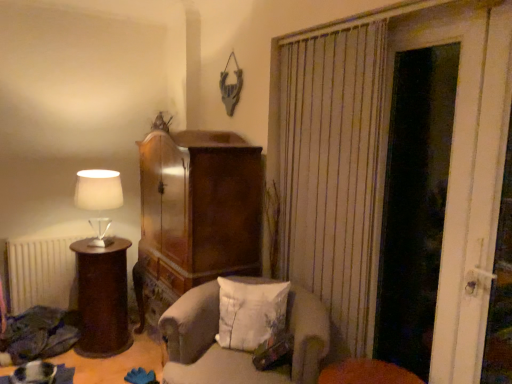
What do you see at coordinates (41, 273) in the screenshot?
I see `white matte radiator at lower left` at bounding box center [41, 273].

Locate an element on the screen. The height and width of the screenshot is (384, 512). light gray fabric chair at center is located at coordinates (237, 350).

Locate an element on the screen. Image resolution: width=512 pixels, height=384 pixels. white wooden door at right is located at coordinates click(428, 184).

The height and width of the screenshot is (384, 512). What do you see at coordinates (250, 313) in the screenshot?
I see `white soft cushion at center` at bounding box center [250, 313].

What is the approximate width of wooden side table at left?

It is 16.15 inches.

Describe the element at coordinates (102, 298) in the screenshot. I see `wooden side table at left` at that location.

Describe the element at coordinates (98, 190) in the screenshot. I see `matte white lampshade at left` at that location.

The width and height of the screenshot is (512, 384). I want to click on white matte radiator at lower left, so click(41, 273).

Which object is wider, white wooden door at right or matte white lampshade at left?

With larger width is matte white lampshade at left.

Is white wooden door at right oriented towards matte white lampshade at left?

No, white wooden door at right is not oriented towards matte white lampshade at left.

Considering the relative sizes of white wooden door at right and matte white lampshade at left in the image provided, is white wooden door at right smaller than matte white lampshade at left?

No, white wooden door at right is not smaller than matte white lampshade at left.

Looking at this image, what's the angular difference between white wooden door at right and matte white lampshade at left's facing directions?

88.3 degrees separate the facing orientations of white wooden door at right and matte white lampshade at left.

Image resolution: width=512 pixels, height=384 pixels. Find the location of `radiator below the white wooden door at right (from the image's perspective)`. radiator below the white wooden door at right (from the image's perspective) is located at coordinates (41, 273).

Which object is positioned more to the right, white matte radiator at lower left or white wooden door at right?

Positioned to the right is white wooden door at right.

From a real-world perspective, who is located higher, white matte radiator at lower left or white wooden door at right?

white wooden door at right is physically above.

Would you say white matte radiator at lower left contains white wooden door at right?

That's incorrect, white wooden door at right is not inside white matte radiator at lower left.

In the scene shown: Is matte white lampshade at left at the back of white soft cushion at center?

No, white soft cushion at center is not facing away from matte white lampshade at left.

Would you say white soft cushion at center is outside matte white lampshade at left?

Yes, white soft cushion at center is outside of matte white lampshade at left.

Considering the relative sizes of white soft cushion at center and matte white lampshade at left in the image provided, is white soft cushion at center shorter than matte white lampshade at left?

Yes.

Consider the image. Which object is closer to the camera taking this photo, white matte radiator at lower left or wooden side table at left?

wooden side table at left is closer to the camera.

Based on the photo, is white matte radiator at lower left turned away from wooden side table at left?

That's right, white matte radiator at lower left is facing away from wooden side table at left.

Is white matte radiator at lower left directly adjacent to wooden side table at left?

white matte radiator at lower left is not next to wooden side table at left, and they're not touching.

Which object is positioned more to the left, white matte radiator at lower left or wooden side table at left?

white matte radiator at lower left is more to the left.

Between white wooden door at right and white matte radiator at lower left, which one is positioned behind?

white matte radiator at lower left is more distant.

The width and height of the screenshot is (512, 384). I want to click on radiator on the left of white wooden door at right, so click(41, 273).

Consider the image. From the image's perspective, which object appears higher, white wooden door at right or white matte radiator at lower left?

white wooden door at right, from the image's perspective.

How far apart are white wooden door at right and white matte radiator at lower left?

They are 7.88 feet apart.

Is the position of light gray fabric chair at center less distant than that of white soft cushion at center?

Yes.

Is light gray fabric chair at center wider or thinner than white soft cushion at center?

light gray fabric chair at center is wider than white soft cushion at center.

From a real-world perspective, which object rests below the other?

In real-world perspective, light gray fabric chair at center is lower.

Considering the points (325, 335) and (251, 307), which point is in front, point (325, 335) or point (251, 307)?

Point (325, 335)

Considering the sizes of objects white matte radiator at lower left and white soft cushion at center in the image provided, who is bigger, white matte radiator at lower left or white soft cushion at center?

Bigger between the two is white matte radiator at lower left.

Is white matte radiator at lower left completely or partially outside of white soft cushion at center?

Yes.

Which point is more distant from viewer, (22, 304) or (279, 311)?

The point (22, 304) is farther from the camera.

Considering the relative positions of white matte radiator at lower left and white soft cushion at center in the image provided, is white matte radiator at lower left in front of white soft cushion at center?

No, white matte radiator at lower left is further to the viewer.

In order to click on door above the matte white lampshade at left (from a real-world perspective) in this screenshot , I will do click(x=428, y=184).

Where is `radiator that appears behind the white wooden door at right`? radiator that appears behind the white wooden door at right is located at coordinates (41, 273).

Considering their positions, is matte white lampshade at left positioned further to white matte radiator at lower left than light gray fabric chair at center?

light gray fabric chair at center is positioned further to the anchor white matte radiator at lower left.

From the image, which object appears to be farther from wooden side table at left, white matte radiator at lower left or white wooden door at right?

white wooden door at right lies further to wooden side table at left than the other object.

Looking at the image, which one is located closer to white soft cushion at center, light gray fabric chair at center or white matte radiator at lower left?

light gray fabric chair at center lies closer to white soft cushion at center than the other object.

When comparing their distances from white wooden door at right, does white matte radiator at lower left or wooden side table at left seem closer?

wooden side table at left is closer to white wooden door at right.

Based on their spatial positions, is white soft cushion at center or matte white lampshade at left further from wooden side table at left?

white soft cushion at center lies further to wooden side table at left than the other object.

When comparing their distances from light gray fabric chair at center, does white matte radiator at lower left or white soft cushion at center seem closer?

white soft cushion at center is closer to light gray fabric chair at center.

Considering their positions, is white wooden door at right positioned further to white soft cushion at center than wooden side table at left?

wooden side table at left is further to white soft cushion at center.

From the image, which object appears to be farther from white matte radiator at lower left, white wooden door at right or wooden side table at left?

white wooden door at right is further to white matte radiator at lower left.

Where is `lamp situated between white matte radiator at lower left and white wooden door at right from left to right`? Image resolution: width=512 pixels, height=384 pixels. lamp situated between white matte radiator at lower left and white wooden door at right from left to right is located at coordinates (98, 190).

The height and width of the screenshot is (384, 512). Identify the location of lamp located between wooden side table at left and light gray fabric chair at center in the left-right direction. (98, 190).

In order to click on chair situated between wooden side table at left and white wooden door at right from left to right in this screenshot , I will do `click(237, 350)`.

Identify the location of radiator that lies between matte white lampshade at left and wooden side table at left from top to bottom. The width and height of the screenshot is (512, 384). click(x=41, y=273).